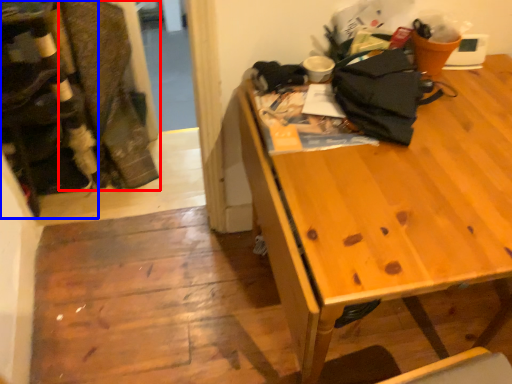
Question: Which of the following is the closest to the observer, laundry (highlighted by a red box) or leftover (highlighted by a blue box)?

Choices:
 (A) laundry
 (B) leftover

Answer: (B)